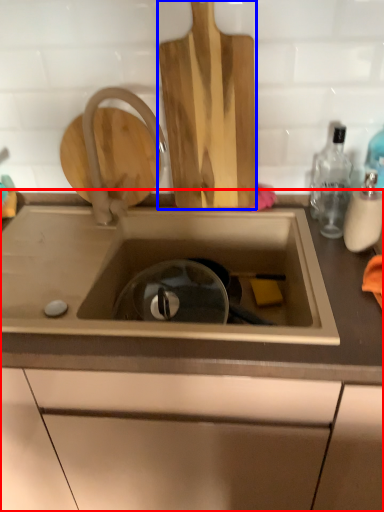
Question: Which of the following is the farthest to the observer, countertop (highlighted by a red box) or cutting board (highlighted by a blue box)?

Choices:
 (A) countertop
 (B) cutting board

Answer: (B)